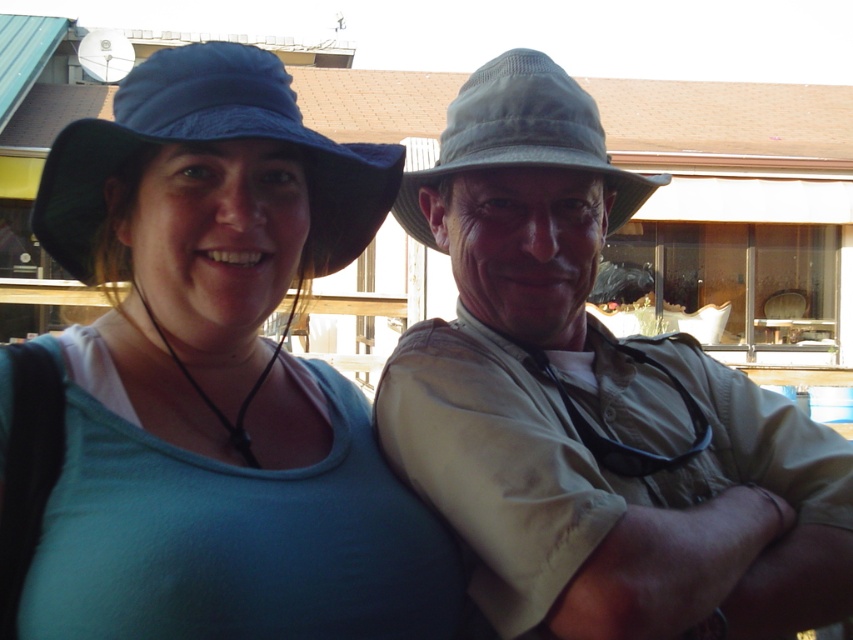
Does matte blue hat at upper left have a smaller size compared to khaki fabric shirt at center?

Yes, matte blue hat at upper left is smaller than khaki fabric shirt at center.

Can you confirm if matte blue hat at upper left is shorter than khaki fabric shirt at center?

Indeed, matte blue hat at upper left has a lesser height compared to khaki fabric shirt at center.

Describe the element at coordinates (219, 378) in the screenshot. The width and height of the screenshot is (853, 640). I see `matte blue hat at upper left` at that location.

At what (x,y) coordinates should I click in order to perform the action: click on matte blue hat at upper left. Please return your answer as a coordinate pair (x, y). This screenshot has width=853, height=640. Looking at the image, I should click on (x=219, y=378).

Between blue fabric cowboy hat at left and gray fabric cowboy hat at upper center, which one is positioned higher?

gray fabric cowboy hat at upper center is higher up.

Does blue fabric cowboy hat at left come behind gray fabric cowboy hat at upper center?

No, it is in front of gray fabric cowboy hat at upper center.

Find the location of `blue fabric cowboy hat at left`. blue fabric cowboy hat at left is located at coordinates (209, 141).

Can you confirm if matte blue hat at upper left is positioned to the left of blue fabric cowboy hat at left?

Incorrect, matte blue hat at upper left is not on the left side of blue fabric cowboy hat at left.

Who is shorter, matte blue hat at upper left or blue fabric cowboy hat at left?

With less height is blue fabric cowboy hat at left.

Is point (224, 339) less distant than point (318, 145)?

No, (224, 339) is behind (318, 145).

You are a GUI agent. You are given a task and a screenshot of the screen. Output one action in this format:
    pyautogui.click(x=<x>, y=<y>)
    Task: Click on the matte blue hat at upper left
    
    Given the screenshot: What is the action you would take?
    [219, 378]